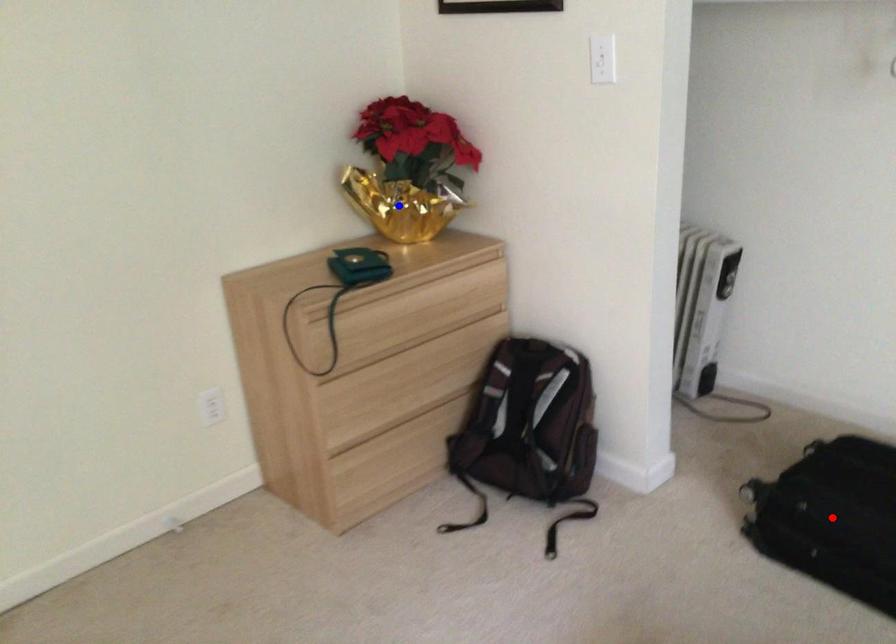
Question: In the image, two points are highlighted. Which point is nearer to the camera? Reply with the corresponding letter.

Choices:
 (A) blue point
 (B) red point

Answer: (B)